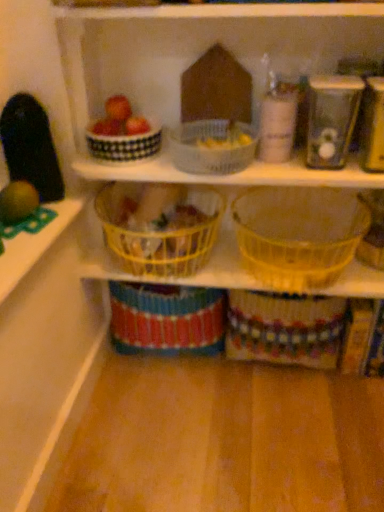
Question: Are matte red apple at upper left and translucent plastic basket at center, acting as the first basket starting from the right, making contact?

Choices:
 (A) no
 (B) yes

Answer: (A)

Question: Can you confirm if matte red apple at upper left is thinner than translucent plastic basket at center, acting as the first basket starting from the right?

Choices:
 (A) yes
 (B) no

Answer: (A)

Question: Does matte red apple at upper left have a smaller size compared to translucent plastic basket at center, positioned as the fourth basket in left-to-right order?

Choices:
 (A) yes
 (B) no

Answer: (A)

Question: Is translucent plastic basket at center, acting as the first basket starting from the right, inside matte red apple at upper left?

Choices:
 (A) yes
 (B) no

Answer: (B)

Question: Does matte red apple at upper left have a larger size compared to translucent plastic basket at center, positioned as the fourth basket in left-to-right order?

Choices:
 (A) no
 (B) yes

Answer: (A)

Question: Is matte red apple at upper left in front of translucent plastic basket at center, acting as the first basket starting from the right?

Choices:
 (A) yes
 (B) no

Answer: (B)

Question: Considering the relative sizes of translucent plastic basket at center, acting as the first basket starting from the right, and white checkered basket at upper center, the 4th basket when ordered from right to left, in the image provided, is translucent plastic basket at center, acting as the first basket starting from the right, bigger than white checkered basket at upper center, the 4th basket when ordered from right to left,?

Choices:
 (A) no
 (B) yes

Answer: (B)

Question: Is translucent plastic basket at center, acting as the first basket starting from the right, further to camera compared to white checkered basket at upper center, which ranks as the first basket in left-to-right order?

Choices:
 (A) no
 (B) yes

Answer: (A)

Question: Does translucent plastic basket at center, acting as the first basket starting from the right, have a greater height compared to white checkered basket at upper center, which ranks as the first basket in left-to-right order?

Choices:
 (A) no
 (B) yes

Answer: (B)

Question: Considering the relative sizes of translucent plastic basket at center, positioned as the fourth basket in left-to-right order, and white checkered basket at upper center, the 4th basket when ordered from right to left, in the image provided, is translucent plastic basket at center, positioned as the fourth basket in left-to-right order, wider than white checkered basket at upper center, the 4th basket when ordered from right to left,?

Choices:
 (A) yes
 (B) no

Answer: (A)

Question: From the image's perspective, would you say translucent plastic basket at center, positioned as the fourth basket in left-to-right order, is shown under white checkered basket at upper center, which ranks as the first basket in left-to-right order?

Choices:
 (A) yes
 (B) no

Answer: (A)

Question: Is the surface of translucent plastic basket at center, acting as the first basket starting from the right, in direct contact with white checkered basket at upper center, which ranks as the first basket in left-to-right order?

Choices:
 (A) no
 (B) yes

Answer: (A)

Question: Is yellow plastic basket at center, placed as the second basket when sorted from left to right, shorter than translucent plastic basket at center, acting as the first basket starting from the right?

Choices:
 (A) no
 (B) yes

Answer: (B)